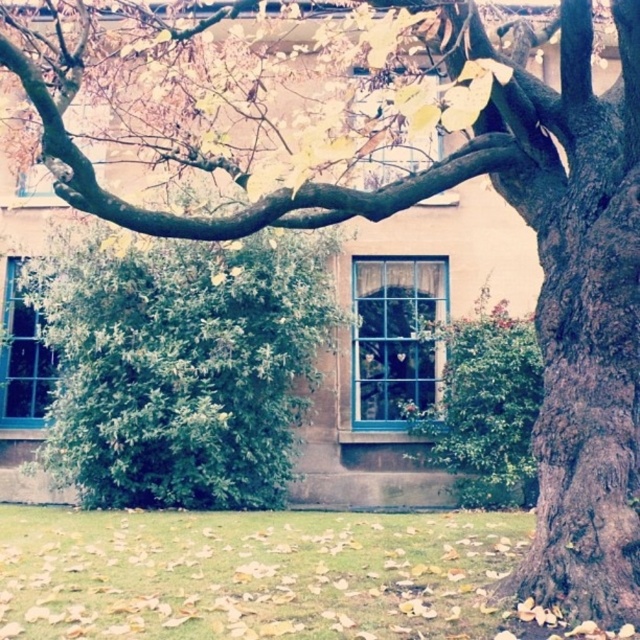
You are standing at the point marked as point (250, 573) in the image. Looking around, you see the tree with yellow leaves and the beige building in the background. What is located directly beneath your feet at this point?

The green grass at lower center is located directly beneath your feet at point (250, 573).

You are standing in the outdoor scene and want to place a small garden ornament between the green grass at lower center and the blue glass window at center left. According to the scene, which object should be on the left side when placing the ornament?

The blue glass window at center left should be on the left side because the green grass at lower center is positioned on the right side of the blue glass window at center left.